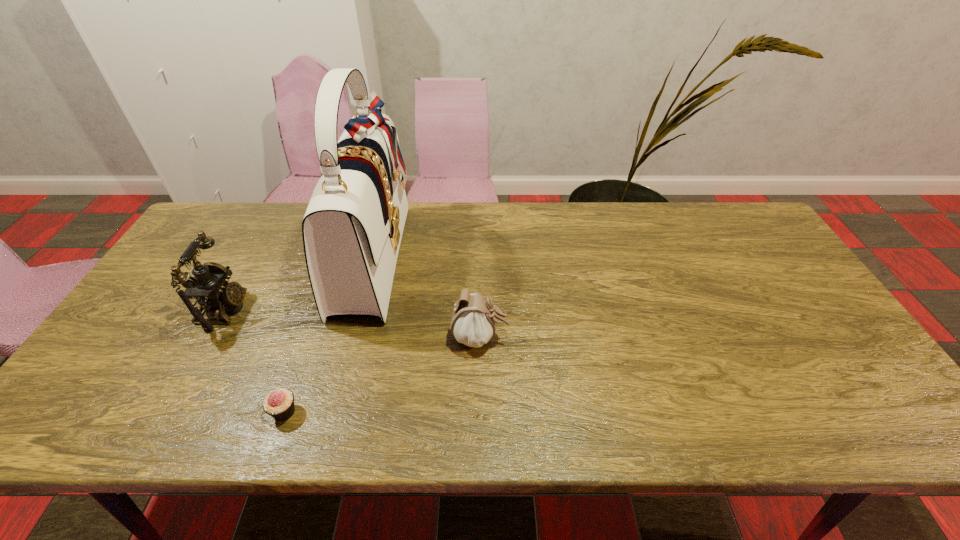
You are a GUI agent. You are given a task and a screenshot of the screen. Output one action in this format:
    pyautogui.click(x=<x>, y=<y>)
    Task: Click on the tallest object
    The height and width of the screenshot is (540, 960).
    Given the screenshot: What is the action you would take?
    pyautogui.click(x=352, y=229)

I want to click on the second tallest object, so click(209, 287).

Locate an element on the screen. This screenshot has width=960, height=540. the leftmost object is located at coordinates (209, 287).

Identify the location of the rightmost object. Image resolution: width=960 pixels, height=540 pixels. (473, 320).

You are a GUI agent. You are given a task and a screenshot of the screen. Output one action in this format:
    pyautogui.click(x=<x>, y=<y>)
    Task: Click on the third tallest object
    The image size is (960, 540).
    Given the screenshot: What is the action you would take?
    pyautogui.click(x=473, y=320)

Find the location of `the shortest object`. the shortest object is located at coordinates (279, 404).

Find the location of `the nearest object`. the nearest object is located at coordinates (279, 404).

At what (x,y) coordinates should I click in order to perform the action: click on vacant space situated 0.320m on the front-facing side of the satchel. Please return your answer as a coordinate pair (x, y). Looking at the image, I should click on (511, 255).

You are a GUI agent. You are given a task and a screenshot of the screen. Output one action in this format:
    pyautogui.click(x=<x>, y=<y>)
    Task: Click on the vacant space located 0.060m on the rotary dial of the third shortest object
    The image size is (960, 540).
    Given the screenshot: What is the action you would take?
    pyautogui.click(x=269, y=310)

This screenshot has height=540, width=960. I want to click on blank space located on the front-facing side of the pouch, so click(607, 338).